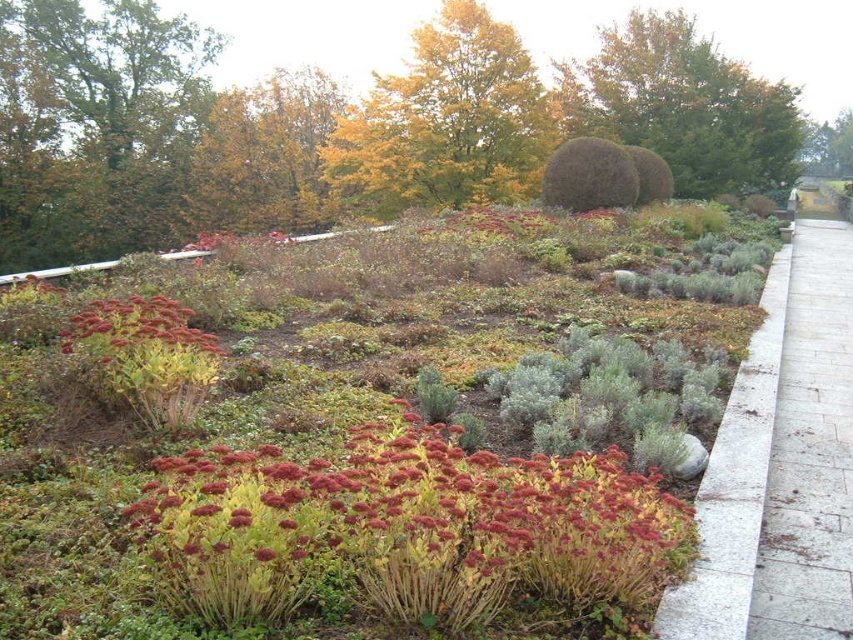
Question: Does reddish-brown textured plant at center appear on the right side of gray stone path at right?

Choices:
 (A) no
 (B) yes

Answer: (A)

Question: Which is nearer to the green leafy tree at upper left?

Choices:
 (A) red matte flower at center
 (B) green leafy tree at upper right

Answer: (A)

Question: Estimate the real-world distances between objects in this image. Which object is closer to the green leafy tree at upper center?

Choices:
 (A) green leafy tree at upper right
 (B) yellow-green foliage at upper center
 (C) green leafy tree at upper left

Answer: (B)

Question: Does gray concrete curb at right have a greater width compared to red matte flower at center?

Choices:
 (A) no
 (B) yes

Answer: (A)

Question: Which point appears closest to the camera in this image?

Choices:
 (A) (688, 609)
 (B) (805, 408)
 (C) (375, 81)

Answer: (A)

Question: Observing the image, what is the correct spatial positioning of yellow-green foliage at upper center in reference to green leafy tree at upper center?

Choices:
 (A) right
 (B) left

Answer: (B)